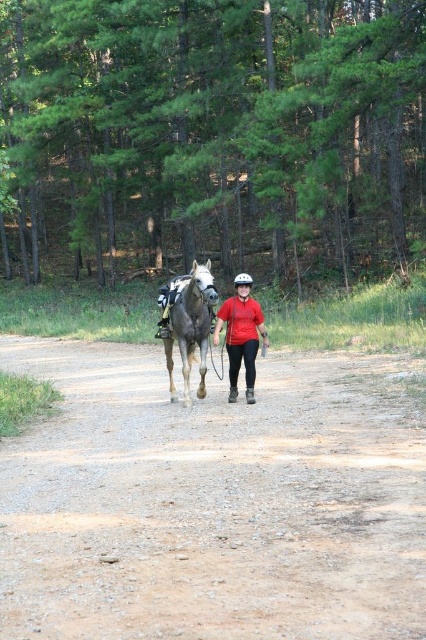
Question: Is brown gravel dirt track at center below brown textured horse at center?

Choices:
 (A) yes
 (B) no

Answer: (A)

Question: Is brown gravel dirt track at center positioned before matte red shirt at center?

Choices:
 (A) no
 (B) yes

Answer: (B)

Question: Is brown gravel dirt track at center bigger than brown textured horse at center?

Choices:
 (A) yes
 (B) no

Answer: (B)

Question: Which of the following is the farthest from the observer?

Choices:
 (A) matte red shirt at center
 (B) brown gravel dirt track at center
 (C) brown textured horse at center

Answer: (A)

Question: Which object appears farthest from the camera in this image?

Choices:
 (A) brown textured horse at center
 (B) brown gravel dirt track at center

Answer: (A)

Question: Estimate the real-world distances between objects in this image. Which object is closer to the matte red shirt at center?

Choices:
 (A) brown textured horse at center
 (B) brown gravel dirt track at center

Answer: (A)